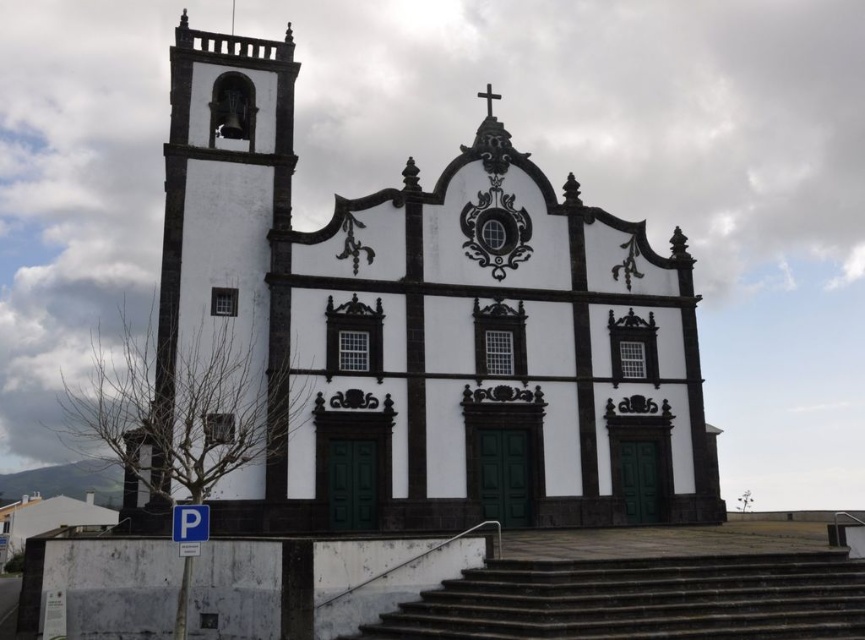
Question: Which object appears farthest from the camera in this image?

Choices:
 (A) white stucco bell tower at left
 (B) dark gray concrete stairs at lower center
 (C) white painted stone chapel at center

Answer: (C)

Question: Is white stucco bell tower at left wider than dark gray concrete stairs at lower center?

Choices:
 (A) no
 (B) yes

Answer: (A)

Question: Which point is closer to the camera?

Choices:
 (A) white stucco bell tower at left
 (B) white painted stone chapel at center

Answer: (A)

Question: Can you confirm if white stucco bell tower at left is positioned above dark gray concrete stairs at lower center?

Choices:
 (A) no
 (B) yes

Answer: (B)

Question: Which object is farther from the camera taking this photo?

Choices:
 (A) dark gray concrete stairs at lower center
 (B) white painted stone chapel at center
 (C) white stucco bell tower at left

Answer: (B)

Question: Can you confirm if white painted stone chapel at center is positioned to the right of dark gray concrete stairs at lower center?

Choices:
 (A) yes
 (B) no

Answer: (B)